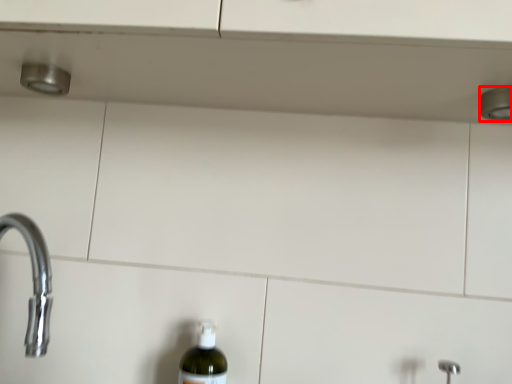
Question: From the image, what is the correct spatial relationship of shower (annotated by the red box) in relation to bottle?

Choices:
 (A) right
 (B) left

Answer: (A)